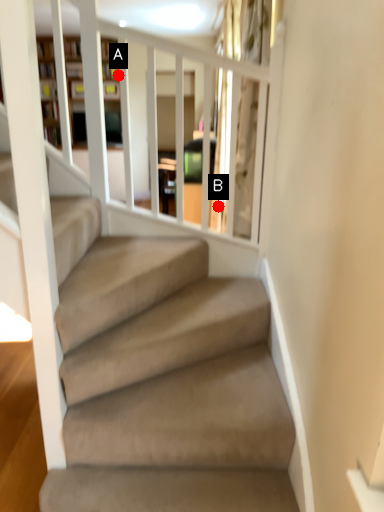
Question: Two points are circled on the image, labeled by A and B beside each circle. Which point is closer to the camera?

Choices:
 (A) A is closer
 (B) B is closer

Answer: (A)